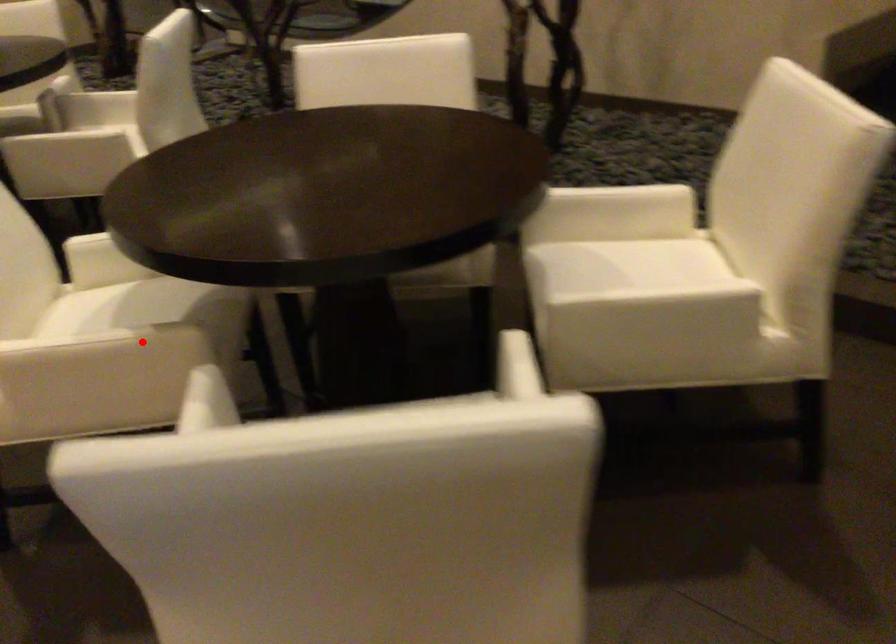
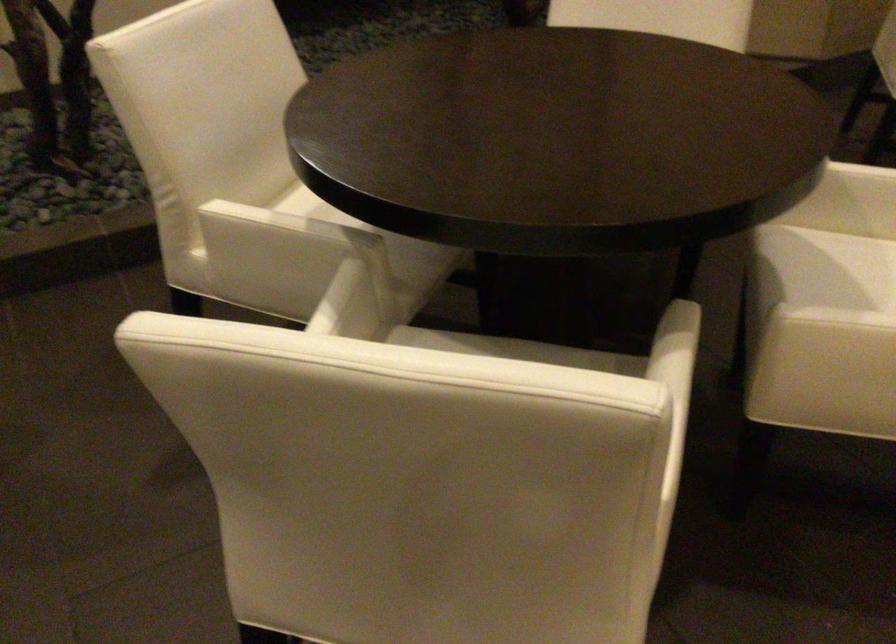
Where in the second image is the point corresponding to the highlighted location from the first image?

(688, 353)